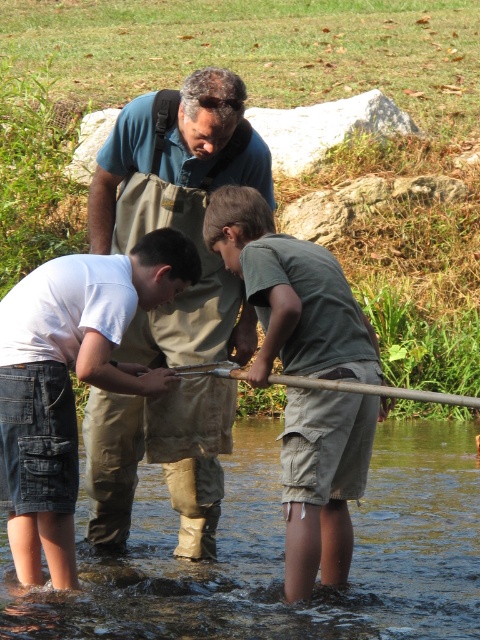
Does green canvas apron at center come behind green cotton shirt at center?

Yes, green canvas apron at center is behind green cotton shirt at center.

Consider the image. Is green canvas apron at center smaller than green cotton shirt at center?

No.

Locate an element on the screen. The height and width of the screenshot is (640, 480). green canvas apron at center is located at coordinates (180, 209).

Locate an element on the screen. green canvas apron at center is located at coordinates (180, 209).

Can you confirm if clear water at lower center is positioned to the left of green canvas apron at center?

Incorrect, clear water at lower center is not on the left side of green canvas apron at center.

Does clear water at lower center have a smaller size compared to green canvas apron at center?

→ Correct, clear water at lower center occupies less space than green canvas apron at center.

Does point (467, 536) come behind point (201, 314)?

That is True.

Locate an element on the screen. The width and height of the screenshot is (480, 640). clear water at lower center is located at coordinates (283, 554).

From the picture: Who is shorter, white cotton shirt at lower left or green cotton shirt at center?

Standing shorter between the two is white cotton shirt at lower left.

Is white cotton shirt at lower left to the right of green cotton shirt at center from the viewer's perspective?

In fact, white cotton shirt at lower left is to the left of green cotton shirt at center.

Between point (75, 474) and point (331, 548), which one is positioned behind?

The point (331, 548) is more distant.

Where is `white cotton shirt at lower left`? This screenshot has height=640, width=480. white cotton shirt at lower left is located at coordinates (69, 381).